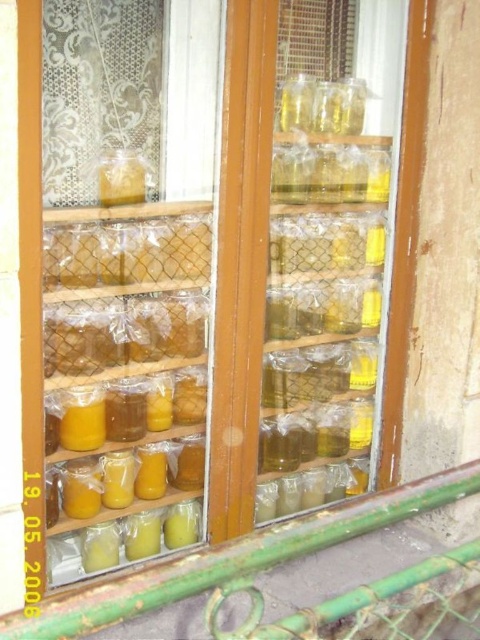
Can you confirm if green metal rail at lower center is positioned above translucent plastic jar at center?

Actually, green metal rail at lower center is below translucent plastic jar at center.

Can you confirm if green metal rail at lower center is positioned to the right of translucent plastic jar at center?

Yes, green metal rail at lower center is to the right of translucent plastic jar at center.

Identify the location of green metal rail at lower center. Image resolution: width=480 pixels, height=640 pixels. (244, 556).

This screenshot has width=480, height=640. I want to click on green metal rail at lower center, so click(x=244, y=556).